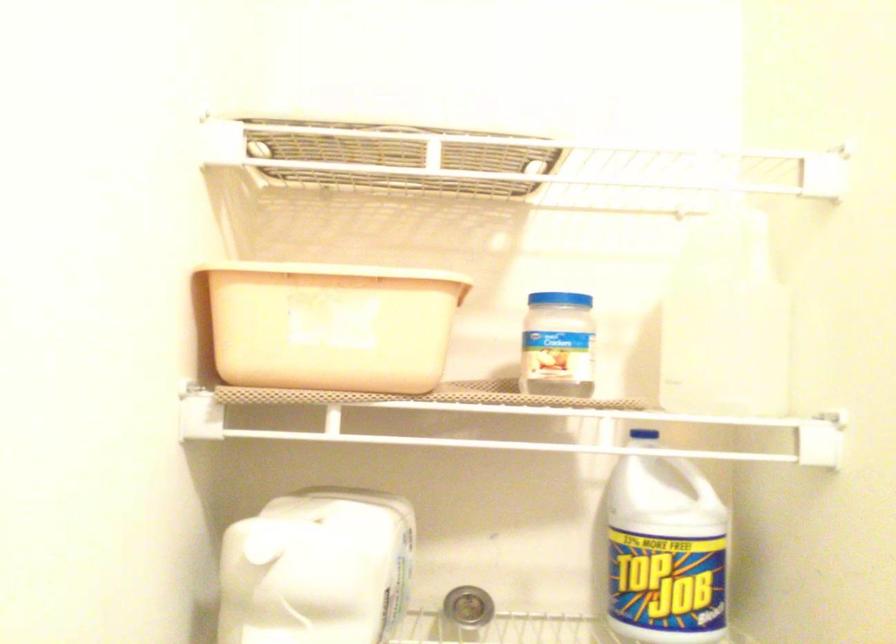
This screenshot has height=644, width=896. What do you see at coordinates (704, 471) in the screenshot? I see `a white bottle handle` at bounding box center [704, 471].